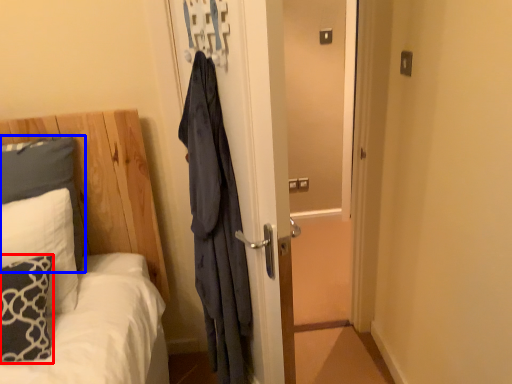
Question: Which object appears closest to the camera in this image, pillow (highlighted by a red box) or pillow (highlighted by a blue box)?

Choices:
 (A) pillow
 (B) pillow

Answer: (A)